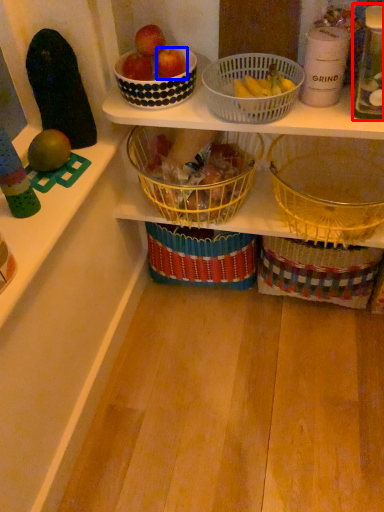
Question: Which object appears closest to the camera in this image, bottle (highlighted by a red box) or apple (highlighted by a blue box)?

Choices:
 (A) bottle
 (B) apple

Answer: (A)